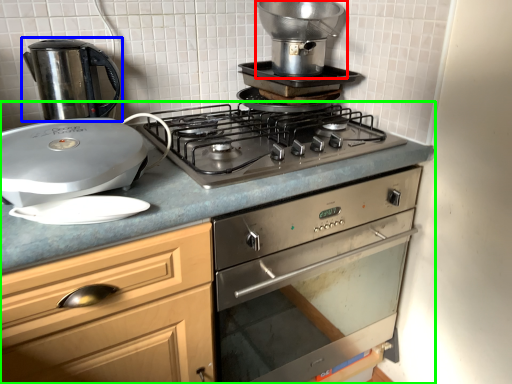
Question: Which object is the closest to the kitchen appliance (highlighted by a red box)? Choose among these: kitchen appliance (highlighted by a blue box) or countertop (highlighted by a green box).

Choices:
 (A) kitchen appliance
 (B) countertop

Answer: (B)